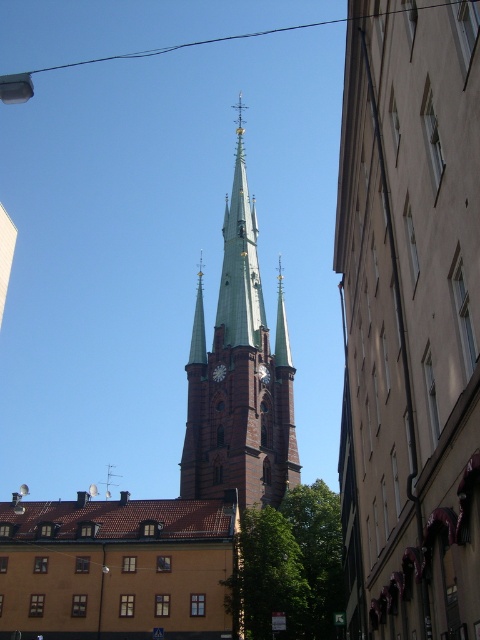
Question: Among these points, which one is nearest to the camera?

Choices:
 (A) (359, 256)
 (B) (261, 305)
 (C) (219, 374)

Answer: (A)

Question: Which of the following is the farthest from the observer?

Choices:
 (A) (196, 289)
 (B) (396, 433)
 (C) (216, 372)
 (D) (249, 349)

Answer: (A)

Question: Based on their relative distances, which object is nearer to the green metallic spire at center?

Choices:
 (A) green glass spire at center
 (B) brown stone church steeple at upper center

Answer: (A)

Question: Is green copper spire at center further to camera compared to green glass spire at center?

Choices:
 (A) no
 (B) yes

Answer: (A)

Question: From the image, what is the correct spatial relationship of green copper spire at center in relation to green metallic spire at center?

Choices:
 (A) right
 (B) left

Answer: (A)

Question: Can you confirm if brown brick church steeple at center is bigger than white glossy clock at center?

Choices:
 (A) no
 (B) yes

Answer: (B)